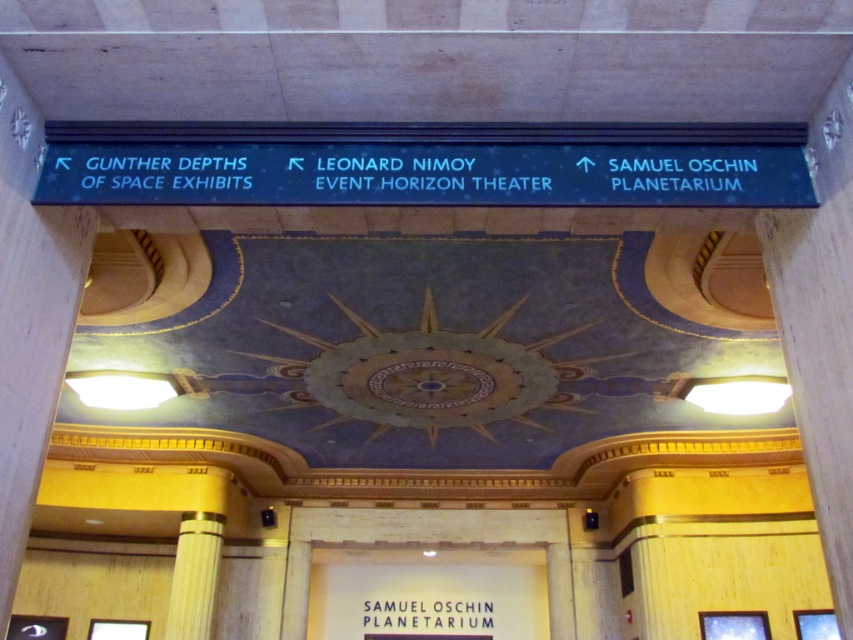
You are standing in the grand hall and want to locate the Samuel Oschin Planetarium. You see the wooden pillar at center and the black matte samuel oschin planetarium at center. Which object is positioned to the left of the other?

The wooden pillar at center is to the left of the black matte samuel oschin planetarium at center.

You are standing in the grand hall and want to locate the wooden pillar at center. What are the coordinates where you can find it?

The wooden pillar at center can be found at coordinates point (194, 576).

You are standing in the grand hall and want to find the Samuel Oschin Planetarium. You see the blue glossy sign at upper center and the black matte Samuel Oschin Planetarium at center. Which object is larger?

The black matte Samuel Oschin Planetarium at center is larger than the blue glossy sign at upper center.